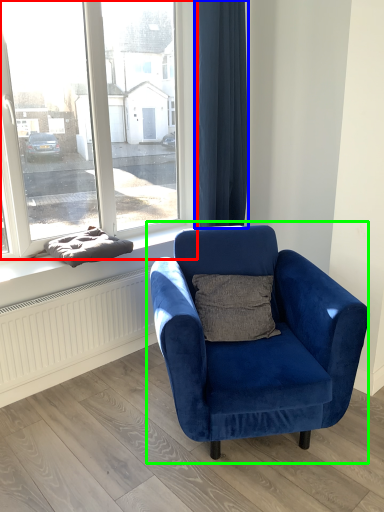
Question: Considering the real-world distances, which object is farthest from window (highlighted by a red box)? curtain (highlighted by a blue box) or chair (highlighted by a green box)?

Choices:
 (A) curtain
 (B) chair

Answer: (B)